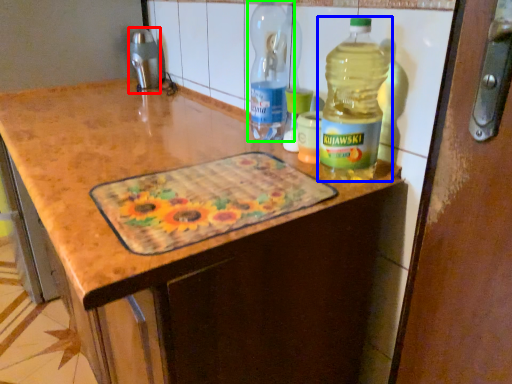
Question: Considering the real-world distances, which object is closest to appliance (highlighted by a red box)? bottle (highlighted by a blue box) or bottle (highlighted by a green box).

Choices:
 (A) bottle
 (B) bottle

Answer: (B)